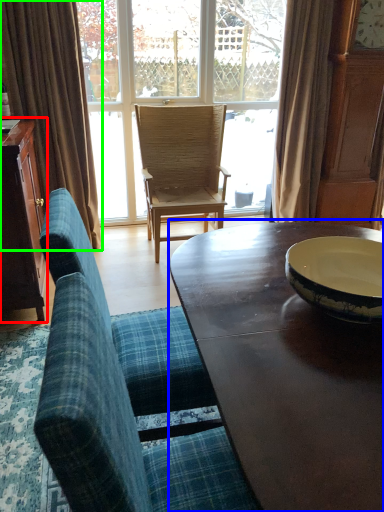
Question: Which object is the closest to the cabinetry (highlighted by a red box)? Choose among these: coffee table (highlighted by a blue box) or curtain (highlighted by a green box).

Choices:
 (A) coffee table
 (B) curtain

Answer: (B)